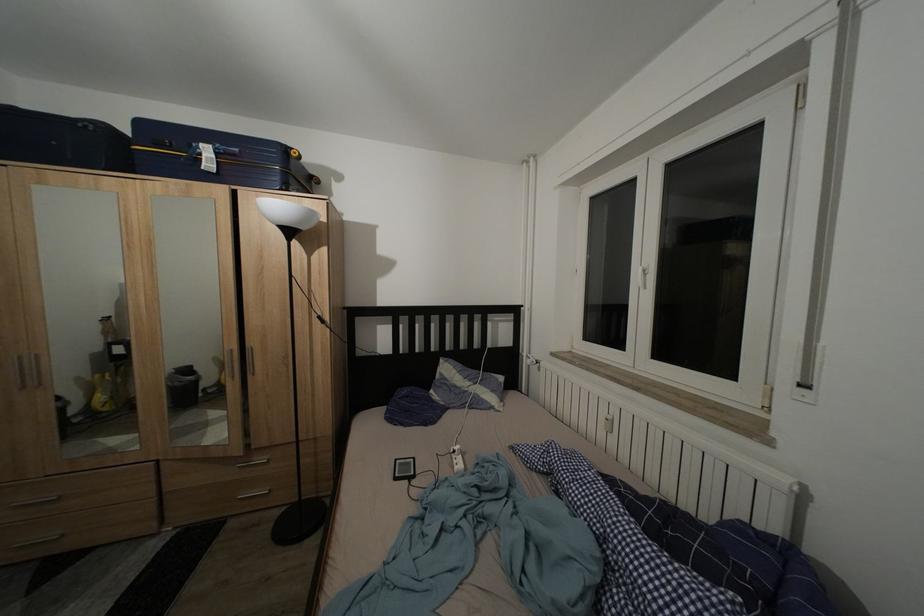
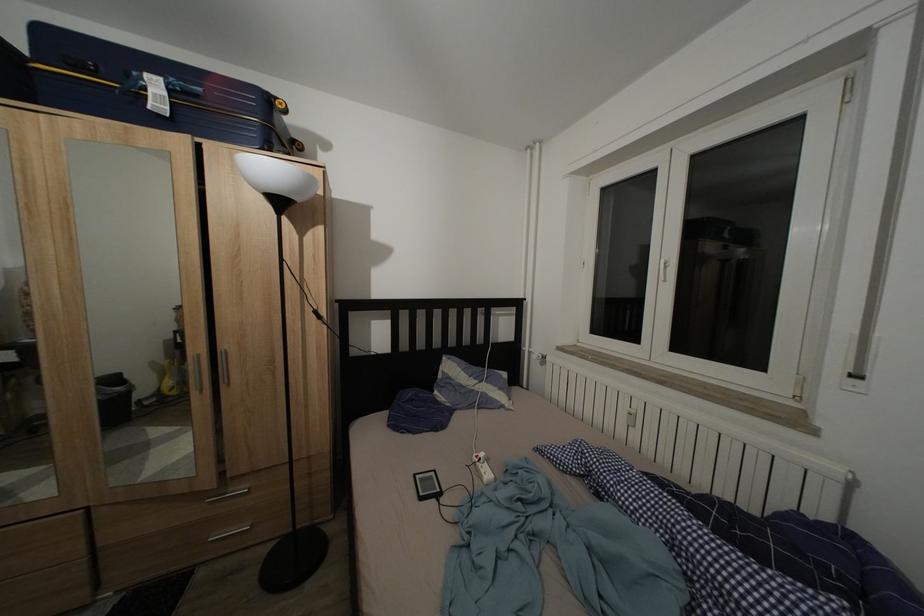
What movement of the cameraman would produce the second image?

The cameraman moved toward left, forward.